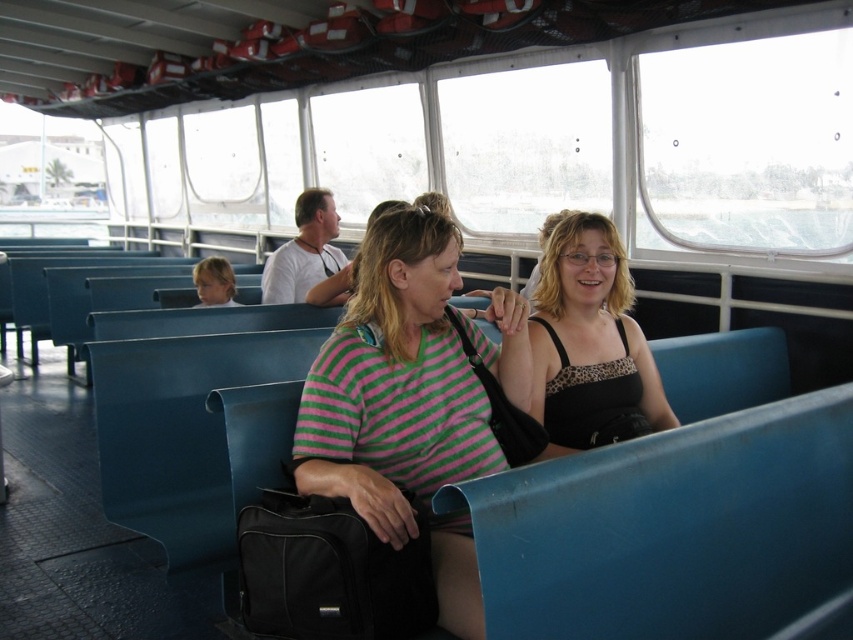
Question: Is white matte shirt at upper center smaller than blonde hair at left?

Choices:
 (A) no
 (B) yes

Answer: (A)

Question: Is white matte shirt at upper center below blonde hair at left?

Choices:
 (A) no
 (B) yes

Answer: (A)

Question: Which of the following is the farthest from the observer?

Choices:
 (A) (306, 236)
 (B) (212, 272)
 (C) (350, 328)
 (D) (550, 266)

Answer: (B)

Question: Which object is farther from the camera taking this photo?

Choices:
 (A) white matte shirt at upper center
 (B) blonde hair at left
 (C) leopard print tank top at center

Answer: (B)

Question: Among these points, which one is nearest to the camera?

Choices:
 (A) (375, 524)
 (B) (218, 289)
 (C) (299, 259)

Answer: (A)

Question: From the image, what is the correct spatial relationship of white matte shirt at upper center in relation to blonde hair at left?

Choices:
 (A) right
 (B) left

Answer: (A)